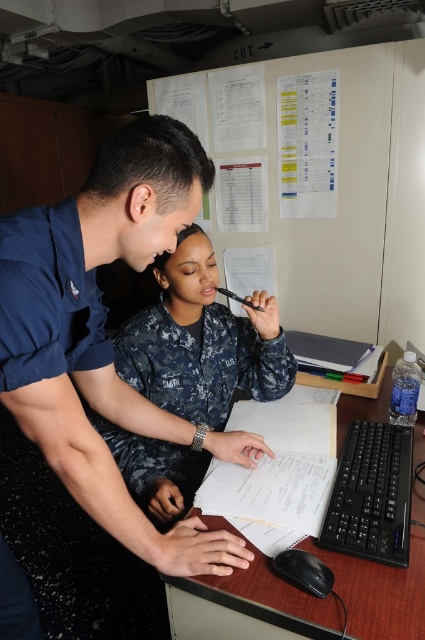
You are an observer in the scene. You notice the dull blue uniform at center and the white paper at center. Which object is wider?

The white paper at center is wider than the dull blue uniform at center.